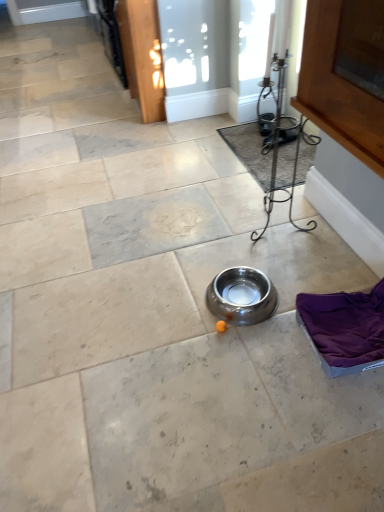
What are the coordinates of `vacant space that's between silver metallic bowl at center and carpeted mat at center` in the screenshot? It's located at (249, 222).